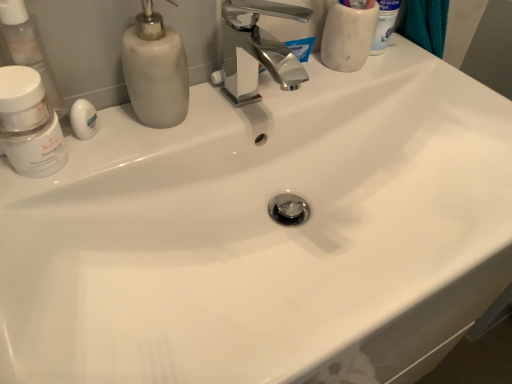
This screenshot has height=384, width=512. Find the location of `vacant area that is situated to the right of white matte jar at left`. vacant area that is situated to the right of white matte jar at left is located at coordinates (158, 145).